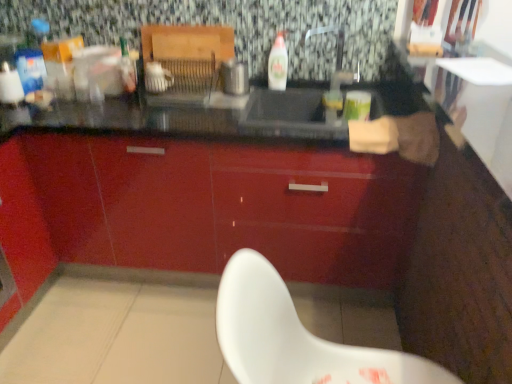
Question: Considering the relative positions of metallic silver toaster at center and white plastic chair at lower center in the image provided, is metallic silver toaster at center to the left or to the right of white plastic chair at lower center?

Choices:
 (A) right
 (B) left

Answer: (B)

Question: From the image's perspective, is metallic silver toaster at center located above or below white plastic chair at lower center?

Choices:
 (A) below
 (B) above

Answer: (B)

Question: Which object is positioned farthest from the glossy red cabinet at center?

Choices:
 (A) white glossy bottle at center
 (B) white plastic chair at lower center
 (C) metallic silver toaster at center

Answer: (B)

Question: Estimate the real-world distances between objects in this image. Which object is farther from the metallic silver toaster at center?

Choices:
 (A) white glossy bottle at center
 (B) glossy red cabinet at center
 (C) white plastic chair at lower center

Answer: (C)